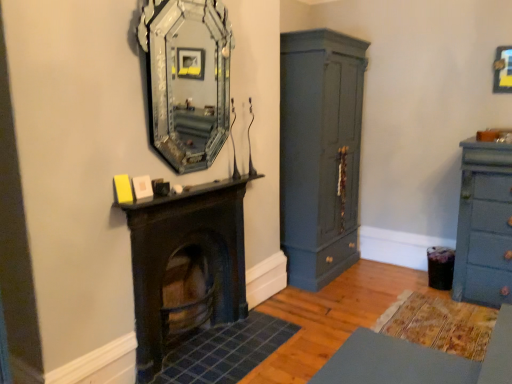
Question: Considering the relative sizes of metallic gold picture frame at upper right and silver mirrored frame at upper center in the image provided, is metallic gold picture frame at upper right bigger than silver mirrored frame at upper center?

Choices:
 (A) no
 (B) yes

Answer: (A)

Question: Is metallic gold picture frame at upper right thinner than silver mirrored frame at upper center?

Choices:
 (A) no
 (B) yes

Answer: (B)

Question: Is there a large distance between metallic gold picture frame at upper right and silver mirrored frame at upper center?

Choices:
 (A) no
 (B) yes

Answer: (B)

Question: Would you say metallic gold picture frame at upper right is outside silver mirrored frame at upper center?

Choices:
 (A) no
 (B) yes

Answer: (B)

Question: Is metallic gold picture frame at upper right surrounding silver mirrored frame at upper center?

Choices:
 (A) yes
 (B) no

Answer: (B)

Question: Does metallic gold picture frame at upper right have a greater width compared to silver mirrored frame at upper center?

Choices:
 (A) no
 (B) yes

Answer: (A)

Question: Does matte blue dresser at right come behind dark wood fireplace at center?

Choices:
 (A) yes
 (B) no

Answer: (A)

Question: Is matte blue dresser at right positioned beyond the bounds of dark wood fireplace at center?

Choices:
 (A) no
 (B) yes

Answer: (B)

Question: Is matte blue dresser at right shorter than dark wood fireplace at center?

Choices:
 (A) no
 (B) yes

Answer: (A)

Question: Is dark wood fireplace at center a part of matte blue dresser at right?

Choices:
 (A) yes
 (B) no

Answer: (B)

Question: From the image's perspective, is matte blue dresser at right under dark wood fireplace at center?

Choices:
 (A) yes
 (B) no

Answer: (B)

Question: Considering the relative positions of matte blue dresser at right and dark wood fireplace at center in the image provided, is matte blue dresser at right to the left of dark wood fireplace at center from the viewer's perspective?

Choices:
 (A) no
 (B) yes

Answer: (A)

Question: From a real-world perspective, does dark wood fireplace at center stand above silver mirrored frame at upper center?

Choices:
 (A) no
 (B) yes

Answer: (A)